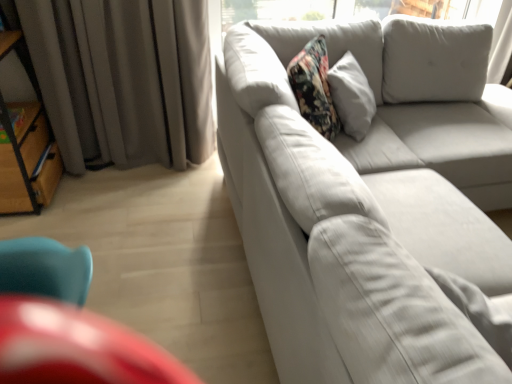
At what (x,y) coordinates should I click in order to perform the action: click on white fabric couch at right. Please return your answer as a coordinate pair (x, y). Looking at the image, I should click on point(368,200).

The image size is (512, 384). Find the location of `white fabric pillow at center`. white fabric pillow at center is located at coordinates (355, 296).

The width and height of the screenshot is (512, 384). What do you see at coordinates (355, 296) in the screenshot?
I see `white fabric pillow at center` at bounding box center [355, 296].

Describe the element at coordinates (25, 144) in the screenshot. I see `woodenmaterial/texturebookshelf at left` at that location.

Where is `white fabric couch at right`? The height and width of the screenshot is (384, 512). white fabric couch at right is located at coordinates (368, 200).

In the scene shown: From the image's perspective, is gray fabric curtain at left above or below white fabric couch at right?

Based on their image positions, gray fabric curtain at left is located above white fabric couch at right.

In the scene shown: Considering the sizes of objects gray fabric curtain at left and white fabric couch at right in the image provided, who is shorter, gray fabric curtain at left or white fabric couch at right?

white fabric couch at right.

Based on the photo, from the image's perspective, is white fabric couch at right located above woodenmaterial/texturebookshelf at left?

Actually, white fabric couch at right appears below woodenmaterial/texturebookshelf at left in the image.

Which is correct: white fabric couch at right is inside woodenmaterial/texturebookshelf at left, or outside of it?

white fabric couch at right lies outside woodenmaterial/texturebookshelf at left.

Is white fabric couch at right thinner than woodenmaterial/texturebookshelf at left?

No, white fabric couch at right is not thinner than woodenmaterial/texturebookshelf at left.

This screenshot has width=512, height=384. Identify the location of curtain lying on the left of white fabric couch at right. (124, 79).

Based on the photo, what's the angular difference between white fabric couch at right and gray fabric curtain at left's facing directions?

There is a 91.9-degree angle between the facing directions of white fabric couch at right and gray fabric curtain at left.

From a real-world perspective, is white fabric couch at right under gray fabric curtain at left?

Yes.

From the image's perspective, would you say white fabric couch at right is positioned over white fabric pillow at center?

Indeed, from the image's perspective, white fabric couch at right is shown above white fabric pillow at center.

From a real-world perspective, is white fabric couch at right located higher than white fabric pillow at center?

Incorrect, from a real-world perspective, white fabric couch at right is lower than white fabric pillow at center.

Considering the relative positions of white fabric couch at right and white fabric pillow at center in the image provided, is white fabric couch at right in front of white fabric pillow at center?

Yes.

Between white fabric couch at right and white fabric pillow at center, which one has less height?

With less height is white fabric pillow at center.

Can you tell me how much white fabric pillow at center and white fabric couch at right differ in facing direction?

They differ by 34 degrees in their facing directions.

Is white fabric pillow at center inside the boundaries of white fabric couch at right, or outside?

white fabric pillow at center is located inside white fabric couch at right.

Considering the sizes of white fabric pillow at center and white fabric couch at right in the image, is white fabric pillow at center taller or shorter than white fabric couch at right?

In the image, white fabric pillow at center appears to be shorter than white fabric couch at right.

Is white fabric pillow at center wider than white fabric couch at right?

In fact, white fabric pillow at center might be narrower than white fabric couch at right.

Between point (41, 47) and point (50, 135), which one is positioned behind?

Positioned behind is point (50, 135).

Based on their sizes in the image, would you say gray fabric curtain at left is bigger or smaller than woodenmaterial/texturebookshelf at left?

In the image, gray fabric curtain at left appears to be larger than woodenmaterial/texturebookshelf at left.

From the picture: From a real-world perspective, is gray fabric curtain at left physically above woodenmaterial/texturebookshelf at left?

Indeed, from a real-world perspective, gray fabric curtain at left stands above woodenmaterial/texturebookshelf at left.

Considering the relative positions of woodenmaterial/texturebookshelf at left and white fabric pillow at center in the image provided, is woodenmaterial/texturebookshelf at left to the left of white fabric pillow at center from the viewer's perspective?

Indeed, woodenmaterial/texturebookshelf at left is positioned on the left side of white fabric pillow at center.

Is woodenmaterial/texturebookshelf at left turned away from white fabric pillow at center?

No, woodenmaterial/texturebookshelf at left is not facing the opposite direction of white fabric pillow at center.

From the image's perspective, does woodenmaterial/texturebookshelf at left appear higher than white fabric pillow at center?

Yes, from the image's perspective, woodenmaterial/texturebookshelf at left is above white fabric pillow at center.

In order to click on studio couch on the right of gray fabric curtain at left in this screenshot , I will do `click(368, 200)`.

In the image, there is a woodenmaterial/texturebookshelf at left. Identify the location of studio couch below it (from the image's perspective). Image resolution: width=512 pixels, height=384 pixels. (368, 200).

Looking at this image, looking at the image, which one is located closer to gray fabric curtain at left, white fabric couch at right or woodenmaterial/texturebookshelf at left?

Based on the image, woodenmaterial/texturebookshelf at left appears to be nearer to gray fabric curtain at left.

Looking at the image, which one is located closer to gray fabric curtain at left, woodenmaterial/texturebookshelf at left or white fabric pillow at center?

woodenmaterial/texturebookshelf at left is positioned closer to the anchor gray fabric curtain at left.

Considering their positions, is white fabric pillow at center positioned closer to white fabric couch at right than woodenmaterial/texturebookshelf at left?

white fabric pillow at center.

From the image, which object appears to be nearer to white fabric couch at right, gray fabric curtain at left or woodenmaterial/texturebookshelf at left?

gray fabric curtain at left lies closer to white fabric couch at right than the other object.

Which object lies nearer to the anchor point white fabric couch at right, gray fabric curtain at left or white fabric pillow at center?

white fabric pillow at center lies closer to white fabric couch at right than the other object.

Which object lies further to the anchor point white fabric couch at right, white fabric pillow at center or gray fabric curtain at left?

Among the two, gray fabric curtain at left is located further to white fabric couch at right.

Estimate the real-world distances between objects in this image. Which object is further from white fabric pillow at center, gray fabric curtain at left or woodenmaterial/texturebookshelf at left?

Among the two, woodenmaterial/texturebookshelf at left is located further to white fabric pillow at center.

Considering their positions, is gray fabric curtain at left positioned further to white fabric pillow at center than white fabric couch at right?

The object further to white fabric pillow at center is gray fabric curtain at left.

The image size is (512, 384). What are the coordinates of `pillow between gray fabric curtain at left and white fabric couch at right in the horizontal direction` in the screenshot? It's located at (355, 296).

Locate an element on the screen. The width and height of the screenshot is (512, 384). pillow between woodenmaterial/texturebookshelf at left and white fabric couch at right is located at coordinates (355, 296).

Identify the location of curtain between woodenmaterial/texturebookshelf at left and white fabric couch at right in the horizontal direction. (124, 79).

Where is `curtain between woodenmaterial/texturebookshelf at left and white fabric pillow at center from left to right`? This screenshot has height=384, width=512. curtain between woodenmaterial/texturebookshelf at left and white fabric pillow at center from left to right is located at coordinates (124, 79).